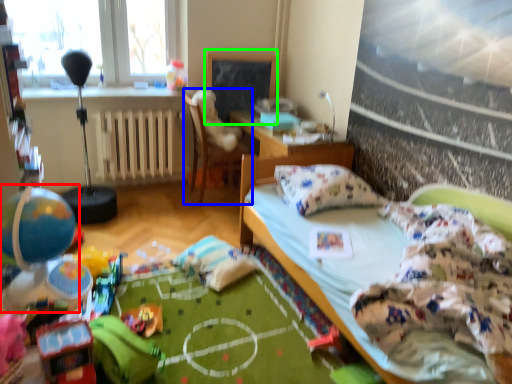
Question: Considering the real-world distances, which object is closest to toy (highlighted by a red box)? chair (highlighted by a blue box) or bulletin board (highlighted by a green box).

Choices:
 (A) chair
 (B) bulletin board

Answer: (A)